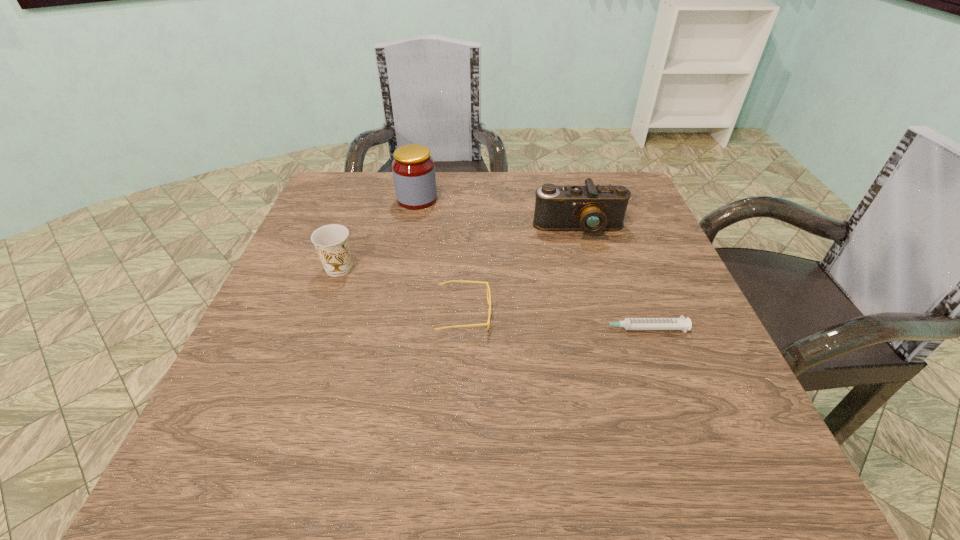
Locate an element on the screen. This screenshot has width=960, height=540. syringe located in the right edge section of the desktop is located at coordinates (681, 323).

What are the coordinates of `object that is at the far right corner` in the screenshot? It's located at (591, 209).

In the image, there is a desktop. Identify the location of free region at the far edge. (391, 179).

The image size is (960, 540). In the image, there is a desktop. What are the coordinates of `vacant space at the near edge` in the screenshot? It's located at (519, 497).

Locate an element on the screen. The width and height of the screenshot is (960, 540). free space at the left edge of the desktop is located at coordinates (299, 290).

The image size is (960, 540). What are the coordinates of `vacant region at the right edge of the desktop` in the screenshot? It's located at (676, 274).

Identify the location of free space at the far left corner of the desktop. This screenshot has width=960, height=540. (334, 217).

This screenshot has height=540, width=960. Identify the location of free point at the near left corner. (179, 489).

At what (x,y) coordinates should I click in order to perform the action: click on vacant region at the far right corner of the desktop. Please return your answer as a coordinate pair (x, y). Looking at the image, I should click on (636, 220).

Locate an element on the screen. The width and height of the screenshot is (960, 540). free space between the spectacles and the fourth shortest object is located at coordinates (521, 271).